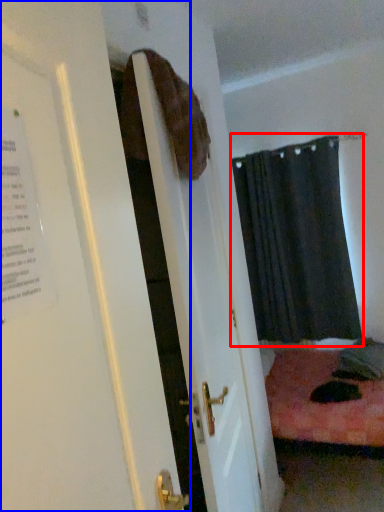
Question: Among these objects, which one is farthest to the camera, curtain (highlighted by a red box) or door (highlighted by a blue box)?

Choices:
 (A) curtain
 (B) door

Answer: (A)